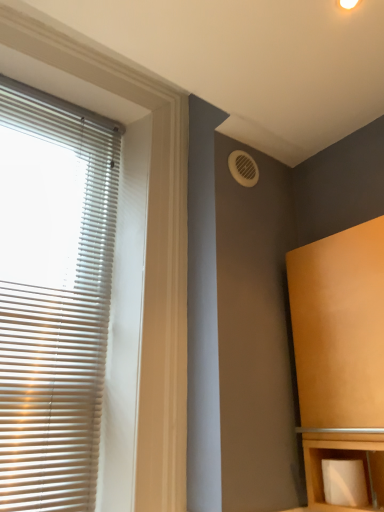
Question: Is matte wood cabinet at right positioned far away from white matte toilet paper at lower right?

Choices:
 (A) yes
 (B) no

Answer: (B)

Question: Is white matte toilet paper at lower right a part of matte wood cabinet at right?

Choices:
 (A) yes
 (B) no

Answer: (A)

Question: From the image's perspective, is matte wood cabinet at right on white matte toilet paper at lower right?

Choices:
 (A) yes
 (B) no

Answer: (A)

Question: Can you confirm if matte wood cabinet at right is taller than white matte toilet paper at lower right?

Choices:
 (A) yes
 (B) no

Answer: (A)

Question: Does matte wood cabinet at right lie in front of white matte toilet paper at lower right?

Choices:
 (A) no
 (B) yes

Answer: (B)

Question: From the image's perspective, is white plastic vent at upper right positioned above or below matte wood cabinet at right?

Choices:
 (A) below
 (B) above

Answer: (B)

Question: Considering the positions of white plastic vent at upper right and matte wood cabinet at right in the image, is white plastic vent at upper right taller or shorter than matte wood cabinet at right?

Choices:
 (A) tall
 (B) short

Answer: (B)

Question: Based on their sizes in the image, would you say white plastic vent at upper right is bigger or smaller than matte wood cabinet at right?

Choices:
 (A) big
 (B) small

Answer: (B)

Question: In the image, is white plastic vent at upper right positioned in front of or behind matte wood cabinet at right?

Choices:
 (A) front
 (B) behind

Answer: (B)

Question: In the image, is white matte blinds at left positioned in front of or behind white plastic vent at upper right?

Choices:
 (A) front
 (B) behind

Answer: (A)

Question: Is white matte blinds at left wider or thinner than white plastic vent at upper right?

Choices:
 (A) thin
 (B) wide

Answer: (B)

Question: From a real-world perspective, relative to white plastic vent at upper right, is white matte blinds at left vertically above or below?

Choices:
 (A) above
 (B) below

Answer: (B)

Question: In terms of height, does white matte blinds at left look taller or shorter compared to white plastic vent at upper right?

Choices:
 (A) tall
 (B) short

Answer: (A)

Question: Based on their positions, is matte wood cabinet at right located to the left or right of white matte blinds at left?

Choices:
 (A) left
 (B) right

Answer: (B)

Question: Is matte wood cabinet at right spatially inside white matte blinds at left, or outside of it?

Choices:
 (A) inside
 (B) outside

Answer: (B)